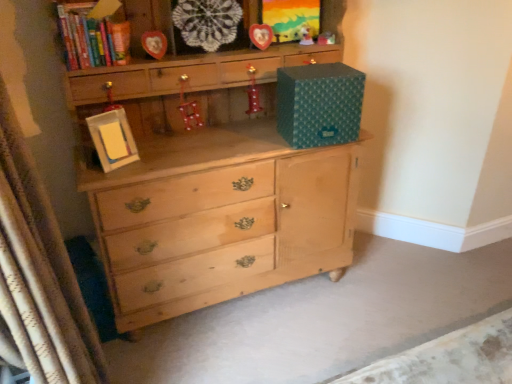
Question: From the image's perspective, is white textured curtain at left located above hardcover book at upper left?

Choices:
 (A) yes
 (B) no

Answer: (B)

Question: Is hardcover book at upper left surrounded by white textured curtain at left?

Choices:
 (A) yes
 (B) no

Answer: (B)

Question: Is white textured curtain at left outside hardcover book at upper left?

Choices:
 (A) yes
 (B) no

Answer: (A)

Question: Is white textured curtain at left further to the viewer compared to hardcover book at upper left?

Choices:
 (A) no
 (B) yes

Answer: (A)

Question: Would you consider white textured curtain at left to be distant from hardcover book at upper left?

Choices:
 (A) no
 (B) yes

Answer: (A)

Question: From their relative heights in the image, would you say teal paper storage box at upper right is taller or shorter than metallic red ornament at center, which is counted as the 4th toy, starting from the top?

Choices:
 (A) tall
 (B) short

Answer: (A)

Question: From a real-world perspective, relative to metallic red ornament at center, which is counted as the first toy, starting from the bottom, is teal paper storage box at upper right vertically above or below?

Choices:
 (A) below
 (B) above

Answer: (A)

Question: Is teal paper storage box at upper right inside or outside of metallic red ornament at center, which is counted as the 4th toy, starting from the top?

Choices:
 (A) outside
 (B) inside

Answer: (A)

Question: Would you say teal paper storage box at upper right is to the left or to the right of metallic red ornament at center, which is the first toy from left to right, in the picture?

Choices:
 (A) right
 (B) left

Answer: (A)

Question: Is point (24, 311) positioned closer to the camera than point (346, 94)?

Choices:
 (A) closer
 (B) farther

Answer: (A)

Question: Is white textured curtain at left in front of or behind teal paper storage box at upper right in the image?

Choices:
 (A) front
 (B) behind

Answer: (A)

Question: In terms of width, does white textured curtain at left look wider or thinner when compared to teal paper storage box at upper right?

Choices:
 (A) thin
 (B) wide

Answer: (B)

Question: From a real-world perspective, is white textured curtain at left physically located above or below teal paper storage box at upper right?

Choices:
 (A) above
 (B) below

Answer: (B)

Question: Do you think shiny red boot at center, the second toy positioned from the bottom, is within wooden heart-shaped frame at upper center, the 1th picture frame in the top-to-bottom sequence, or outside of it?

Choices:
 (A) inside
 (B) outside

Answer: (B)

Question: From a real-world perspective, is shiny red boot at center, the second toy when ordered from left to right, above or below wooden heart-shaped frame at upper center, which is the fourth picture frame in bottom-to-top order?

Choices:
 (A) above
 (B) below

Answer: (B)